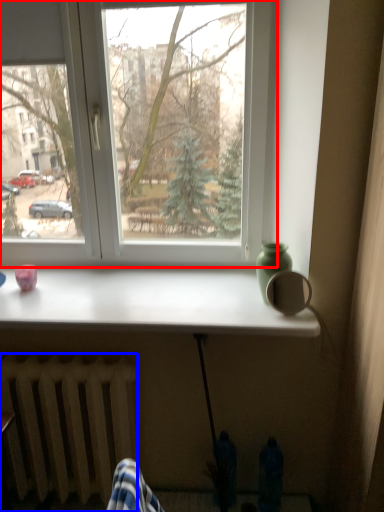
Question: Which point is closer to the camera, window (highlighted by a red box) or radiator (highlighted by a blue box)?

Choices:
 (A) window
 (B) radiator

Answer: (B)